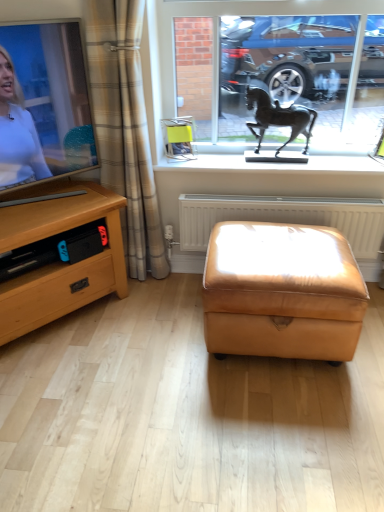
Locate an element on the screen. The height and width of the screenshot is (512, 384). free location above saddle brown leather ottoman at center (from a real-world perspective) is located at coordinates (279, 246).